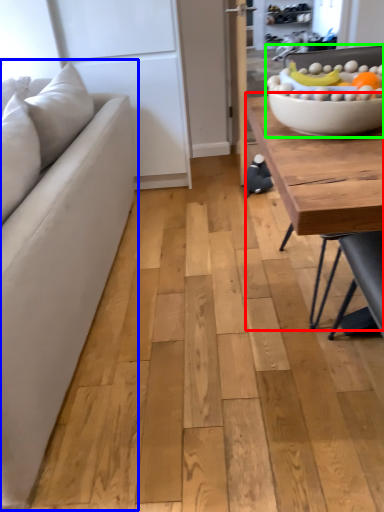
Question: Which is farther away from coffee table (highlighted by a red box)? studio couch (highlighted by a blue box) or bowl (highlighted by a green box)?

Choices:
 (A) studio couch
 (B) bowl

Answer: (A)